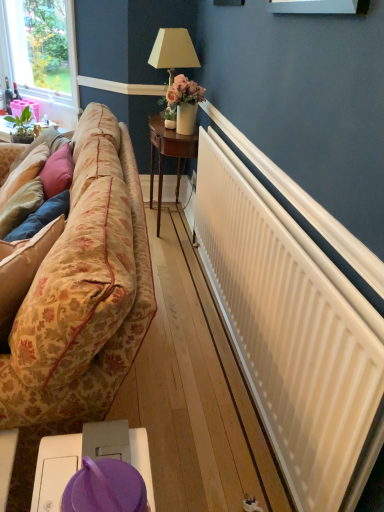
Question: Is clear glass window at upper left in front of or behind white matte radiator at right in the image?

Choices:
 (A) front
 (B) behind

Answer: (B)

Question: From a real-world perspective, is clear glass window at upper left above or below white matte radiator at right?

Choices:
 (A) above
 (B) below

Answer: (A)

Question: Estimate the real-world distances between objects in this image. Which object is closer to the floral fabric couch at left?

Choices:
 (A) beige fabric lampshade at upper center
 (B) white matte radiator at right
 (C) clear glass window at upper left
 (D) wooden side table at center, the second table in the top-to-bottom sequence
 (E) purple fabric at lower center, marked as the first table in a bottom-to-top arrangement

Answer: (B)

Question: Which is farther from the floral fabric couch at left?

Choices:
 (A) purple fabric at lower center, positioned as the 3th table in left-to-right order
 (B) clear glass window at upper left
 (C) white matte radiator at right
 (D) matte pink plastic at left, positioned as the 1th table in back-to-front order
 (E) wooden side table at center, arranged as the 2th table when viewed from the front

Answer: (B)